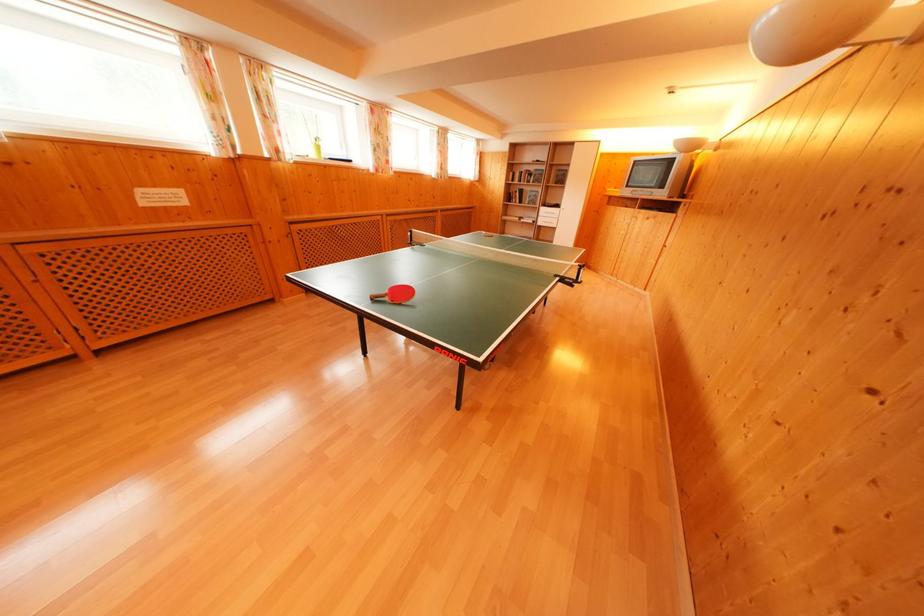
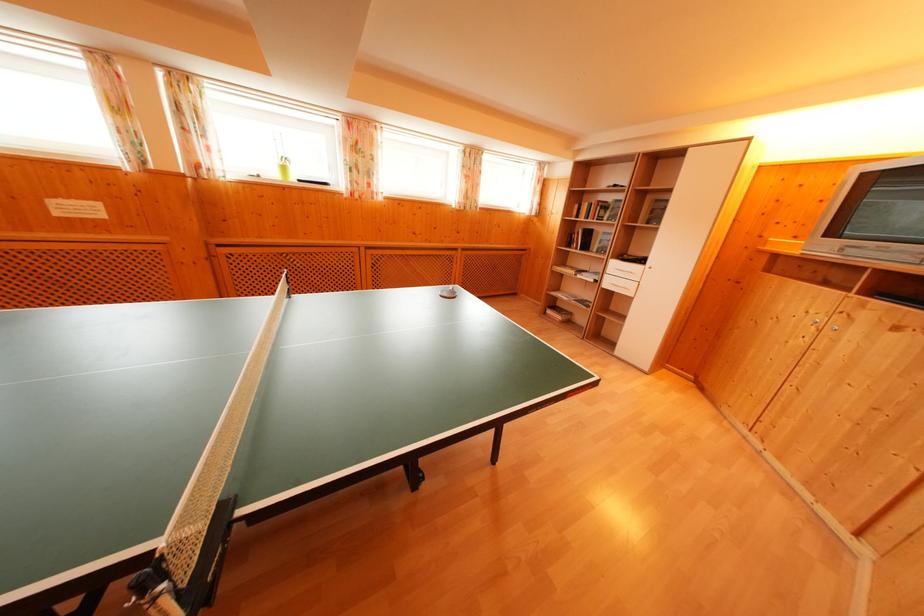
The point at (x=516, y=179) is marked in the first image. Where is the corresponding point in the second image?

(581, 211)